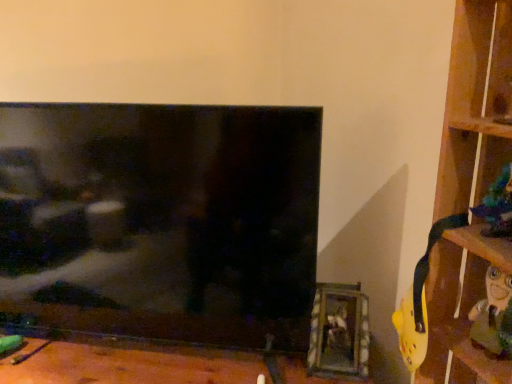
Question: Which is correct: black glossy tv at center is inside shiny blue figurine at right, or outside of it?

Choices:
 (A) outside
 (B) inside

Answer: (A)

Question: Looking at their shapes, would you say black glossy tv at center is wider or thinner than shiny blue figurine at right?

Choices:
 (A) wide
 (B) thin

Answer: (A)

Question: Which of these objects is positioned farthest from the shiny blue figurine at right?

Choices:
 (A) black glossy tv at center
 (B) wooden picture frame at lower right
 (C) wooden at right

Answer: (A)

Question: Estimate the real-world distances between objects in this image. Which object is closer to the wooden picture frame at lower right?

Choices:
 (A) black glossy tv at center
 (B) wooden at right
 (C) shiny blue figurine at right

Answer: (B)